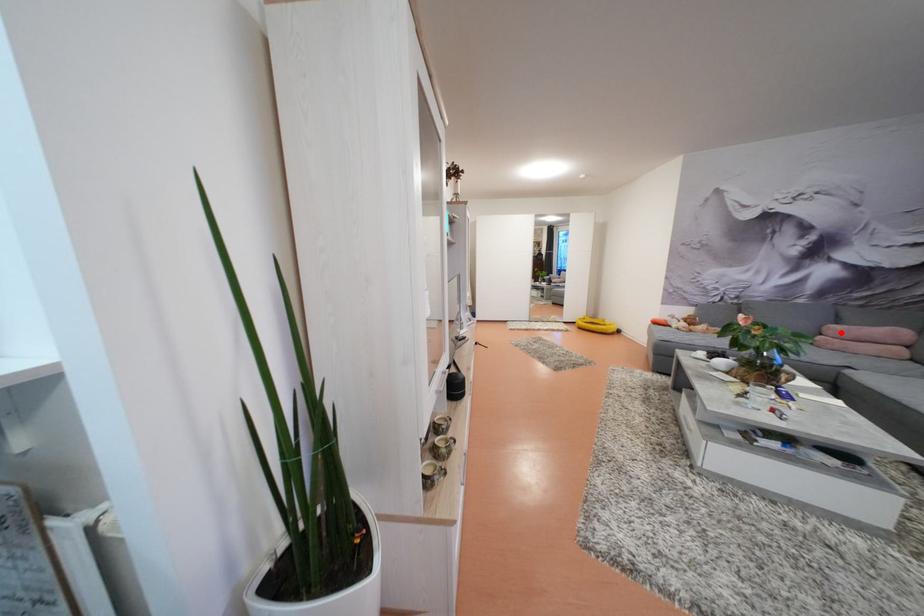
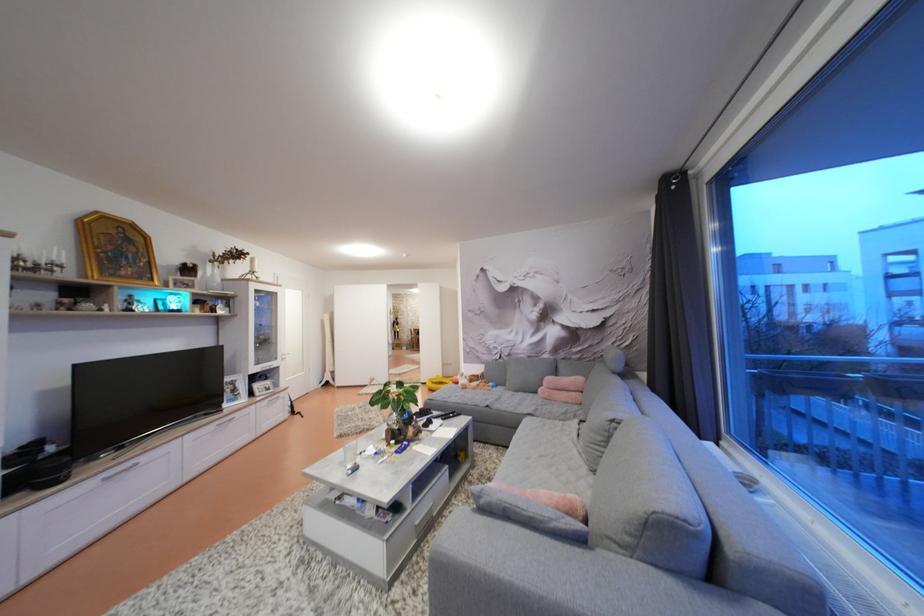
Question: I am providing you with two images of the same scene from different viewpoints. In image1, a red point is highlighted. Considering the same 3D point in image2, which of the following is correct?

Choices:
 (A) It is closer
 (B) It is farther

Answer: (B)